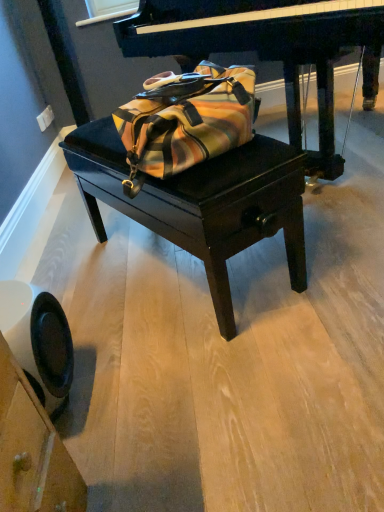
In order to click on free space behind black plastic swivel chair at lower left in this screenshot , I will do `click(95, 336)`.